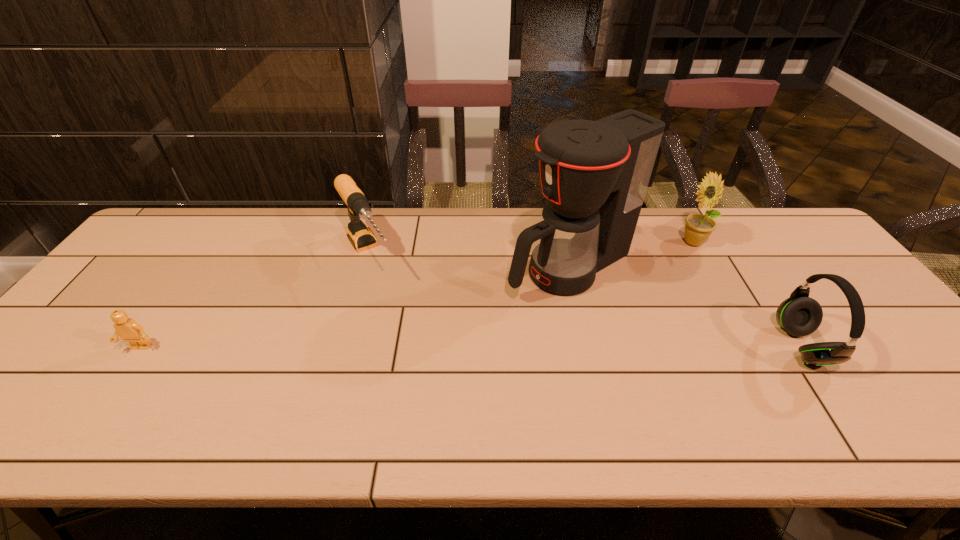
Identify the location of free space between the second object from left to right and the leftmost object. (254, 301).

Locate an element on the screen. unoccupied area between the drill and the shortest object is located at coordinates (254, 301).

At what (x,y) coordinates should I click in order to perform the action: click on vacant area between the second object from right to left and the fourth object from right to left. Please return your answer as a coordinate pair (x, y). The width and height of the screenshot is (960, 540). Looking at the image, I should click on (531, 248).

Where is `free space that is in between the rightmost object and the third object from left to right`? free space that is in between the rightmost object and the third object from left to right is located at coordinates (685, 307).

What are the coordinates of `unoccupied position between the fourth object from left to right and the Lego` in the screenshot? It's located at (417, 295).

Locate an element on the screen. This screenshot has width=960, height=540. vacant area that lies between the sunflower and the headset is located at coordinates (748, 294).

Where is `free space between the headset and the second object from right to left`? free space between the headset and the second object from right to left is located at coordinates (748, 294).

Locate an element on the screen. This screenshot has height=540, width=960. vacant space that is in between the headset and the sunflower is located at coordinates (748, 294).

Identify which object is the third nearest to the drill. Please provide its 2D coordinates. Your answer should be formatted as a tuple, i.e. [(x, y)], where the tuple contains the x and y coordinates of a point satisfying the conditions above.

[(698, 227)]

Locate an element on the screen. The image size is (960, 540). object that ranks as the third closest to the drill is located at coordinates (698, 227).